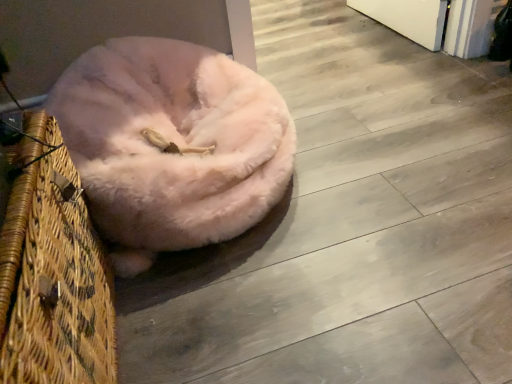
What is the approximate width of fuzzy pink dog bed at center?

fuzzy pink dog bed at center is 24.23 inches wide.

This screenshot has width=512, height=384. What do you see at coordinates (172, 143) in the screenshot?
I see `fuzzy pink dog bed at center` at bounding box center [172, 143].

Locate an element on the screen. The image size is (512, 384). fuzzy pink dog bed at center is located at coordinates (172, 143).

At what (x,y) coordinates should I click in order to perform the action: click on woven straw basket at left. Please return your answer as a coordinate pair (x, y). This screenshot has width=512, height=384. Looking at the image, I should click on (53, 273).

The image size is (512, 384). What do you see at coordinates (53, 273) in the screenshot? I see `woven straw basket at left` at bounding box center [53, 273].

I want to click on fuzzy pink dog bed at center, so click(x=172, y=143).

Can you confirm if woven straw basket at left is positioned to the left of fuzzy pink dog bed at center?

Yes, woven straw basket at left is to the left of fuzzy pink dog bed at center.

Considering their positions, is woven straw basket at left located in front of or behind fuzzy pink dog bed at center?

Visually, woven straw basket at left is located in front of fuzzy pink dog bed at center.

Does point (46, 358) lie in front of point (78, 81)?

Yes, point (46, 358) is closer to viewer.

From the image's perspective, between woven straw basket at left and fuzzy pink dog bed at center, who is located below?

woven straw basket at left appears lower in the image.

From a real-world perspective, who is located higher, woven straw basket at left or fuzzy pink dog bed at center?

woven straw basket at left, from a real-world perspective.

Which object is thinner, woven straw basket at left or fuzzy pink dog bed at center?

Thinner between the two is woven straw basket at left.

Between woven straw basket at left and fuzzy pink dog bed at center, which one has more height?

woven straw basket at left.

In terms of size, does woven straw basket at left appear bigger or smaller than fuzzy pink dog bed at center?

In the image, woven straw basket at left appears to be smaller than fuzzy pink dog bed at center.

Does woven straw basket at left contain fuzzy pink dog bed at center?

No, fuzzy pink dog bed at center is not inside woven straw basket at left.

Is woven straw basket at left placed right next to fuzzy pink dog bed at center?

No, woven straw basket at left is not next to fuzzy pink dog bed at center.

Is woven straw basket at left aimed at fuzzy pink dog bed at center?

No, woven straw basket at left is not turned towards fuzzy pink dog bed at center.

What's the angular difference between woven straw basket at left and fuzzy pink dog bed at center's facing directions?

90 degrees.

At what (x,y) coordinates should I click in order to perform the action: click on basket lying below the fuzzy pink dog bed at center (from the image's perspective). Please return your answer as a coordinate pair (x, y). Looking at the image, I should click on (53, 273).

Does fuzzy pink dog bed at center appear on the right side of woven straw basket at left?

Indeed, fuzzy pink dog bed at center is positioned on the right side of woven straw basket at left.

Does fuzzy pink dog bed at center come in front of woven straw basket at left?

No, fuzzy pink dog bed at center is behind woven straw basket at left.

Is point (175, 144) more distant than point (93, 279)?

Yes, it is.

From the image's perspective, which one is positioned higher, fuzzy pink dog bed at center or woven straw basket at left?

fuzzy pink dog bed at center appears higher in the image.

From a real-world perspective, between fuzzy pink dog bed at center and woven straw basket at left, who is vertically higher?

From a 3D spatial view, woven straw basket at left is above.

Looking at this image, is fuzzy pink dog bed at center thinner than woven straw basket at left?

Incorrect, the width of fuzzy pink dog bed at center is not less than that of woven straw basket at left.

Looking at this image, is fuzzy pink dog bed at center shorter than woven straw basket at left?

Yes, fuzzy pink dog bed at center is shorter than woven straw basket at left.

Which of these two, fuzzy pink dog bed at center or woven straw basket at left, is smaller?

woven straw basket at left is smaller.

Would you say fuzzy pink dog bed at center is outside woven straw basket at left?

That's correct, fuzzy pink dog bed at center is outside of woven straw basket at left.

From the picture: Is fuzzy pink dog bed at center beside woven straw basket at left?

No, fuzzy pink dog bed at center is not next to woven straw basket at left.

Could you tell me if fuzzy pink dog bed at center is turned towards woven straw basket at left?

Yes, fuzzy pink dog bed at center is oriented towards woven straw basket at left.

Can you tell me how much fuzzy pink dog bed at center and woven straw basket at left differ in facing direction?

The angular difference between fuzzy pink dog bed at center and woven straw basket at left is 90 degrees.

The image size is (512, 384). I want to click on basket that appears on the left of fuzzy pink dog bed at center, so pos(53,273).

Find the location of a particular element. The width and height of the screenshot is (512, 384). basket that is on the left side of fuzzy pink dog bed at center is located at coordinates (53, 273).

You are a GUI agent. You are given a task and a screenshot of the screen. Output one action in this format:
    pyautogui.click(x=<x>, y=<y>)
    Task: Click on the basket below the fuzzy pink dog bed at center (from the image's perspective)
    The height and width of the screenshot is (384, 512).
    Given the screenshot: What is the action you would take?
    pyautogui.click(x=53, y=273)